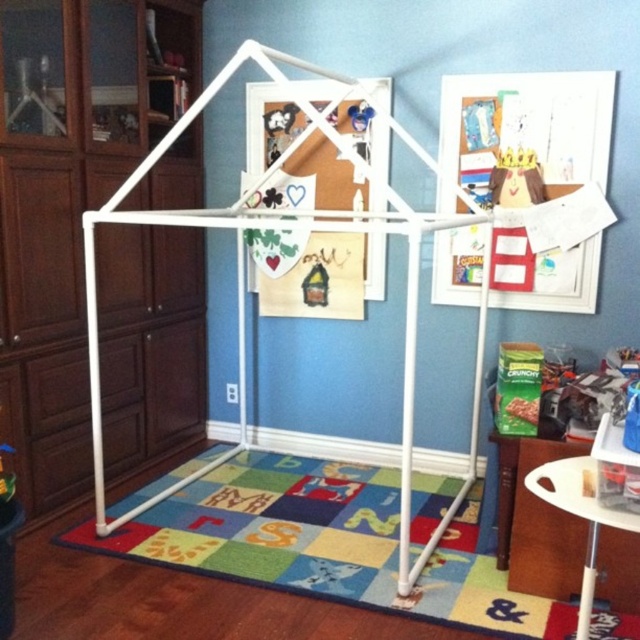
Who is more distant from viewer, (x=248, y=148) or (x=289, y=138)?

Point (x=248, y=148)

Which of these two, matte cardboard picture frame at center or matte plastic toy at center, stands taller?

With more height is matte cardboard picture frame at center.

Is point (320, 292) less distant than point (273, 138)?

No, it is behind (273, 138).

Where is `matte cardboard picture frame at center`? The image size is (640, 640). matte cardboard picture frame at center is located at coordinates (324, 278).

Describe the element at coordinates (525, 132) in the screenshot. I see `matte cardboard picture frame at upper center` at that location.

From the picture: Does matte cardboard picture frame at upper center have a greater width compared to white plastic stool at lower right?

Yes.

Is point (593, 163) farther from viewer compared to point (582, 582)?

That is True.

Identify the location of matte cardboard picture frame at upper center. Image resolution: width=640 pixels, height=640 pixels. (525, 132).

From the picture: Can you confirm if matte cardboard picture frame at center is thinner than white plastic stool at lower right?

No.

Is matte cardboard picture frame at center taller than white plastic stool at lower right?

Indeed, matte cardboard picture frame at center has a greater height compared to white plastic stool at lower right.

Image resolution: width=640 pixels, height=640 pixels. What do you see at coordinates (324, 278) in the screenshot? I see `matte cardboard picture frame at center` at bounding box center [324, 278].

Locate an element on the screen. The height and width of the screenshot is (640, 640). matte cardboard picture frame at center is located at coordinates (324, 278).